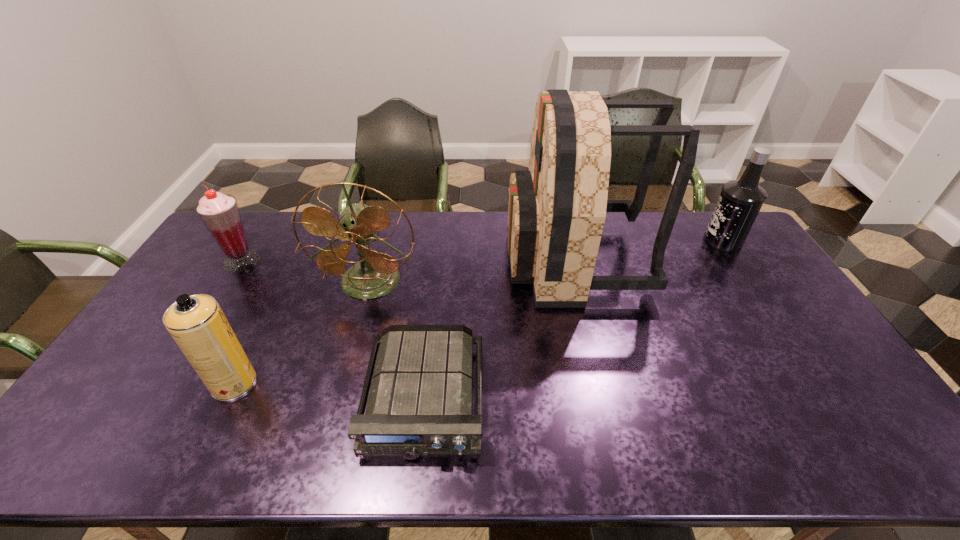
The image size is (960, 540). Find the location of `empty space between the radio receiver and the rightmost object`. empty space between the radio receiver and the rightmost object is located at coordinates (573, 319).

Locate an element on the screen. This screenshot has width=960, height=540. free spot between the fan and the aerosol can is located at coordinates (301, 332).

This screenshot has width=960, height=540. What are the coordinates of `vacant space in between the smoothie and the aerosol can` in the screenshot? It's located at (238, 322).

At what (x,y) coordinates should I click in order to perform the action: click on blank region between the fifth object from right to left and the fan. Please return your answer as a coordinate pair (x, y). This screenshot has height=540, width=960. Looking at the image, I should click on 301,332.

The height and width of the screenshot is (540, 960). In order to click on vacant space that is in between the tallest object and the smoothie in this screenshot , I will do (408, 260).

Identify which object is located as the fourth nearest to the aerosol can. Please provide its 2D coordinates. Your answer should be formatted as a tuple, i.e. [(x, y)], where the tuple contains the x and y coordinates of a point satisfying the conditions above.

[(557, 209)]

Select which object appears as the closest to the second object from left to right. Please provide its 2D coordinates. Your answer should be formatted as a tuple, i.e. [(x, y)], where the tuple contains the x and y coordinates of a point satisfying the conditions above.

[(376, 274)]

At what (x,y) coordinates should I click in order to perform the action: click on vacant region that satisfies the following two spatial constraints: 1. on the front face of the second object from right to left; 2. in front of the fan, directing air flow. Please return your answer as a coordinate pair (x, y). Looking at the image, I should click on (579, 282).

Find the location of a particular element. The height and width of the screenshot is (540, 960). free location that satisfies the following two spatial constraints: 1. on the front label of the liquor; 2. on the front side of the aerosol can is located at coordinates (819, 383).

Find the location of a particular element. This screenshot has width=960, height=540. blank space that satisfies the following two spatial constraints: 1. on the front face of the tallest object; 2. on the front panel of the radio receiver is located at coordinates (608, 398).